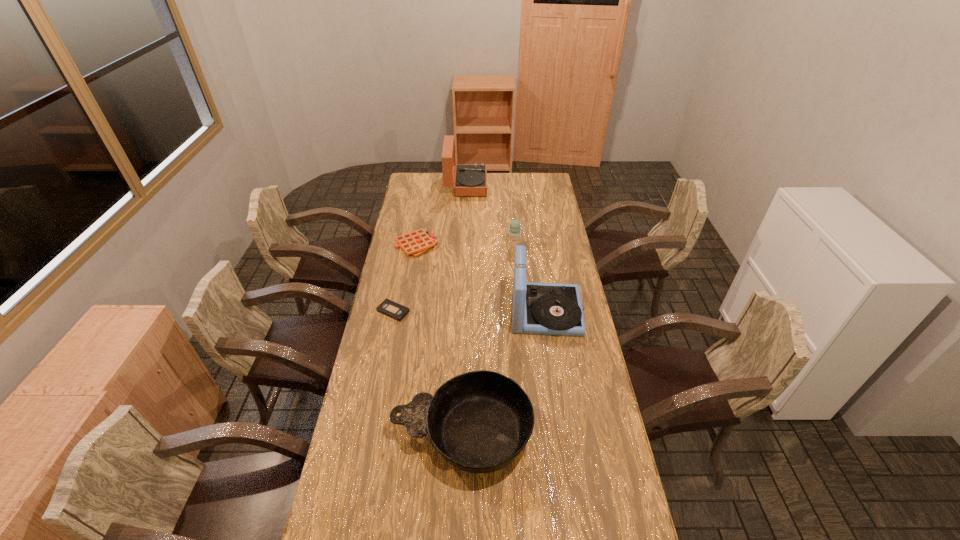
I want to click on blank area in the image that satisfies the following two spatial constraints: 1. with the handle extending from the side of the right phonograph record; 2. on the right side of the frying pan, so click(x=466, y=312).

Where is `vacant space that satisfies the following two spatial constraints: 1. with the handle extending from the side of the right phonograph record; 2. on the right side of the fourth tallest object`? The image size is (960, 540). vacant space that satisfies the following two spatial constraints: 1. with the handle extending from the side of the right phonograph record; 2. on the right side of the fourth tallest object is located at coordinates (466, 312).

At what (x,y) coordinates should I click in order to perform the action: click on vacant region that satisfies the following two spatial constraints: 1. with the handle extending from the side of the right phonograph record; 2. on the right side of the frying pan. Please return your answer as a coordinate pair (x, y). Looking at the image, I should click on (466, 312).

Where is `free space in the image that satisfies the following two spatial constraints: 1. with the handle extending from the side of the frying pan; 2. on the back side of the nearer phonograph record`? This screenshot has height=540, width=960. free space in the image that satisfies the following two spatial constraints: 1. with the handle extending from the side of the frying pan; 2. on the back side of the nearer phonograph record is located at coordinates (466, 312).

Where is `vacant space that satisfies the following two spatial constraints: 1. on the face of the farther phonograph record; 2. on the right side of the third tallest object`? The image size is (960, 540). vacant space that satisfies the following two spatial constraints: 1. on the face of the farther phonograph record; 2. on the right side of the third tallest object is located at coordinates (464, 245).

The image size is (960, 540). Find the location of `vacant position in the image that satisfies the following two spatial constraints: 1. with the handle extending from the side of the nearer phonograph record; 2. on the right side of the nearest object`. vacant position in the image that satisfies the following two spatial constraints: 1. with the handle extending from the side of the nearer phonograph record; 2. on the right side of the nearest object is located at coordinates (466, 312).